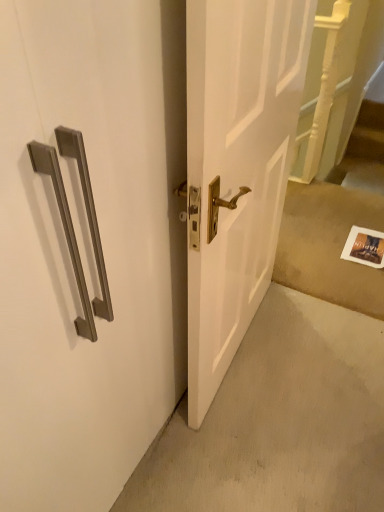
Where is `satin nickel handle at upper left`? The image size is (384, 512). satin nickel handle at upper left is located at coordinates (102, 244).

Find the location of a particular element. white paper at lower right is located at coordinates tap(329, 246).

You are a GUI agent. You are given a task and a screenshot of the screen. Output one action in this format:
    pyautogui.click(x=<x>, y=<y>)
    Task: Click on the wooden staircase at right
    This screenshot has height=512, width=384.
    Given the screenshot: What is the action you would take?
    pyautogui.click(x=363, y=152)

What's the angular difference between satin nickel handle at upper left and white paper at lower right's facing directions?

91.9 degrees.

Are satin nickel handle at upper left and white paper at lower right far apart?

satin nickel handle at upper left is far away from white paper at lower right.

From the picture: Can you confirm if satin nickel handle at upper left is positioned to the left of white paper at lower right?

Yes, satin nickel handle at upper left is to the left of white paper at lower right.

The height and width of the screenshot is (512, 384). I want to click on door on the left side of white paper at lower right, so click(x=102, y=244).

From the picture: How different are the orientations of wooden staircase at right and white paper at lower right in degrees?

The angular difference between wooden staircase at right and white paper at lower right is 93.8 degrees.

Is wooden staircase at right inside the boundaries of white paper at lower right, or outside?

wooden staircase at right is not inside white paper at lower right, it's outside.

From the image's perspective, is wooden staircase at right located beneath white paper at lower right?

No, from the image's perspective, wooden staircase at right is not below white paper at lower right.

From a real-world perspective, is wooden staircase at right physically above white paper at lower right?

Incorrect, from a real-world perspective, wooden staircase at right is lower than white paper at lower right.

Consider the image. In terms of height, does white paper at lower right look taller or shorter compared to wooden staircase at right?

Clearly, white paper at lower right is shorter compared to wooden staircase at right.

Is white paper at lower right to the right of wooden staircase at right from the viewer's perspective?

No.

Is white paper at lower right looking in the opposite direction of wooden staircase at right?

No.

Which of these two, white paper at lower right or wooden staircase at right, is smaller?

wooden staircase at right.

From the picture: Is wooden staircase at right not near satin nickel handle at upper left?

Indeed, wooden staircase at right is not near satin nickel handle at upper left.

The height and width of the screenshot is (512, 384). Find the location of `door that appears above the wooden staircase at right (from a real-world perspective)`. door that appears above the wooden staircase at right (from a real-world perspective) is located at coordinates click(102, 244).

Is wooden staircase at right taller than satin nickel handle at upper left?

Incorrect, the height of wooden staircase at right is not larger of that of satin nickel handle at upper left.

From a real-world perspective, is wooden staircase at right physically below satin nickel handle at upper left?

Yes, from a real-world perspective, wooden staircase at right is beneath satin nickel handle at upper left.

Looking at their sizes, would you say white paper at lower right is wider or thinner than satin nickel handle at upper left?

Clearly, white paper at lower right has more width compared to satin nickel handle at upper left.

From the image's perspective, which one is positioned higher, white paper at lower right or satin nickel handle at upper left?

white paper at lower right is shown above in the image.

How far apart are white paper at lower right and satin nickel handle at upper left?

They are 1.28 meters apart.

From a real-world perspective, is white paper at lower right physically below satin nickel handle at upper left?

Yes.

Is there a large distance between satin nickel handle at upper left and wooden staircase at right?

Yes.

Is point (78, 423) behind point (369, 138)?

No, it is not.

Considering the positions of objects satin nickel handle at upper left and wooden staircase at right in the image provided, who is behind, satin nickel handle at upper left or wooden staircase at right?

Positioned behind is wooden staircase at right.

Is satin nickel handle at upper left facing towards wooden staircase at right?

No.

Find the location of `concrete behind the satin nickel handle at upper left`. concrete behind the satin nickel handle at upper left is located at coordinates (329, 246).

The height and width of the screenshot is (512, 384). In order to click on stairwell on the right of white paper at lower right in this screenshot , I will do `click(363, 152)`.

From the image, which object appears to be farther from satin nickel handle at upper left, wooden staircase at right or white paper at lower right?

wooden staircase at right is further to satin nickel handle at upper left.

Looking at the image, which one is located closer to white paper at lower right, wooden staircase at right or satin nickel handle at upper left?

wooden staircase at right is closer to white paper at lower right.

When comparing their distances from wooden staircase at right, does white paper at lower right or satin nickel handle at upper left seem further?

The object further to wooden staircase at right is satin nickel handle at upper left.

Considering their positions, is satin nickel handle at upper left positioned closer to white paper at lower right than wooden staircase at right?

wooden staircase at right is closer to white paper at lower right.

Which object lies further to the anchor point satin nickel handle at upper left, white paper at lower right or wooden staircase at right?

Based on the image, wooden staircase at right appears to be further to satin nickel handle at upper left.

Based on their spatial positions, is satin nickel handle at upper left or white paper at lower right further from wooden staircase at right?

satin nickel handle at upper left lies further to wooden staircase at right than the other object.

Where is `concrete positioned between satin nickel handle at upper left and wooden staircase at right from near to far`? concrete positioned between satin nickel handle at upper left and wooden staircase at right from near to far is located at coordinates (329, 246).